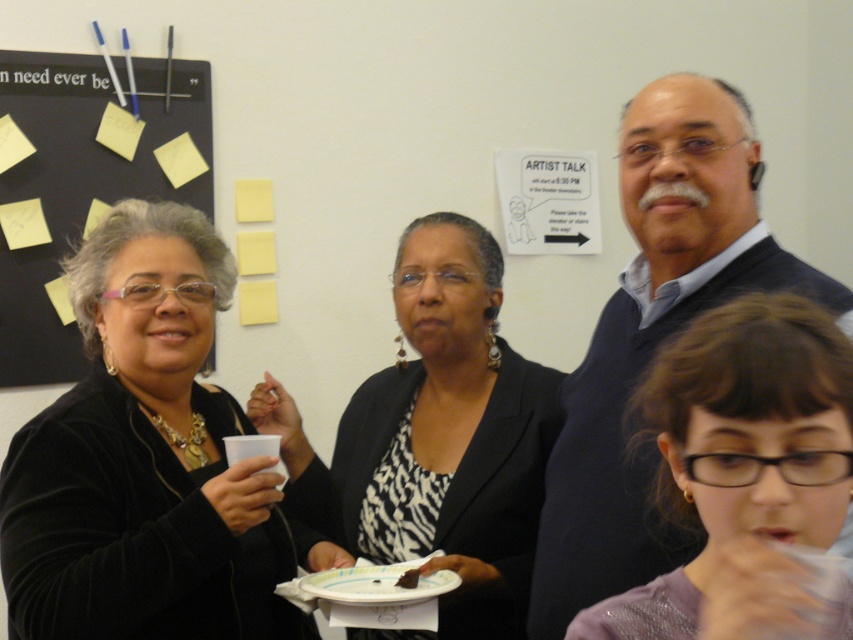
Question: Which point appears farthest from the camera in this image?

Choices:
 (A) (189, 93)
 (B) (576, 442)

Answer: (A)

Question: Where is black velvet sweater at left located in relation to white paper plate at lower center in the image?

Choices:
 (A) below
 (B) above

Answer: (B)

Question: Does zebra print blouse at center have a lesser width compared to chocolate cake at center?

Choices:
 (A) yes
 (B) no

Answer: (B)

Question: Estimate the real-world distances between objects in this image. Which object is closer to the white paper plate at lower center?

Choices:
 (A) chocolate cake at center
 (B) black matte board at upper left
 (C) dark blue sweater at upper right

Answer: (A)

Question: Considering the real-world distances, which object is farthest from the dark blue sweater at upper right?

Choices:
 (A) white paper plate at lower center
 (B) chocolate cake at center
 (C) black matte board at upper left

Answer: (C)

Question: Is black velvet sweater at left thinner than black matte board at upper left?

Choices:
 (A) no
 (B) yes

Answer: (A)